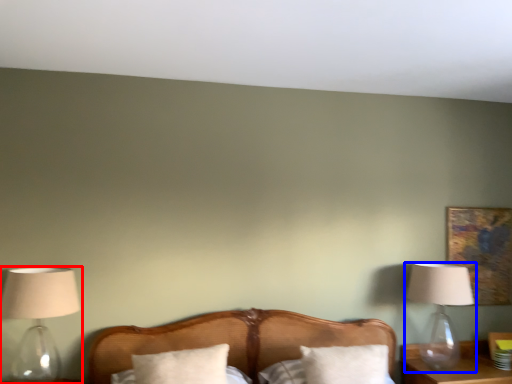
Question: Which object appears farthest to the camera in this image, lamp (highlighted by a red box) or lamp (highlighted by a blue box)?

Choices:
 (A) lamp
 (B) lamp

Answer: (B)